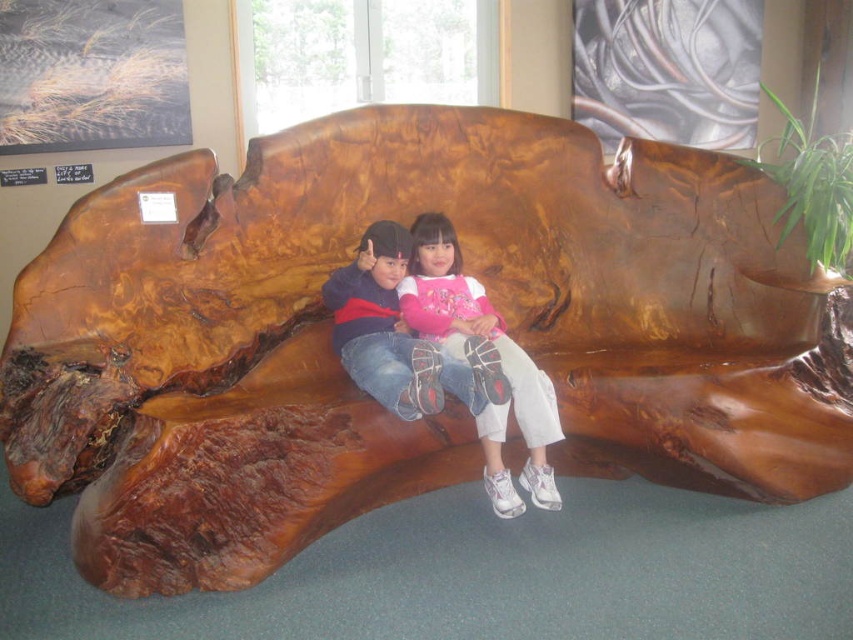
Is matte pink shirt at center bigger than matte brown wooden bench at center?

Yes, matte pink shirt at center is bigger than matte brown wooden bench at center.

Is matte pink shirt at center shorter than matte brown wooden bench at center?

No, matte pink shirt at center is not shorter than matte brown wooden bench at center.

Who is more forward, (503, 483) or (354, 284)?

Point (503, 483) is in front.

The width and height of the screenshot is (853, 640). What are the coordinates of `matte pink shirt at center` in the screenshot? It's located at (479, 337).